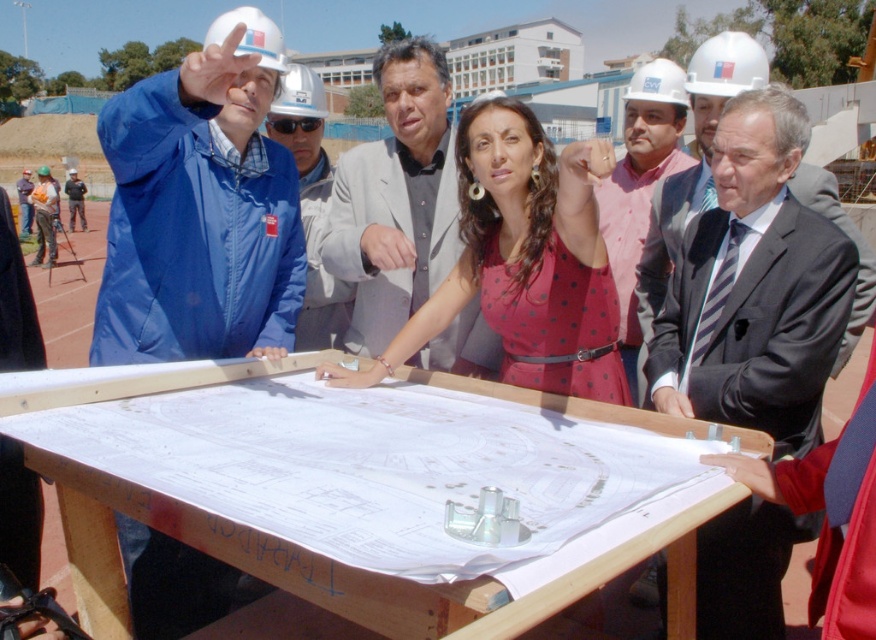
You are a photographer at the construction site and need to capture a clear photo of both the blue fabric jacket at left and the blue fabric jacket at upper left. Since the jackets are different in size, which one should you focus on to ensure both are visible in the frame?

The blue fabric jacket at left is bigger than the blue fabric jacket at upper left. To ensure both are visible, focus on the larger jacket first, then adjust the frame to include the smaller one without cropping either.

You are an architect standing at the edge of the construction site. You see the point marked at coordinates (524, 260) on the blueprint. What is the nearest object to this point?

The nearest object to the point marked at coordinates (524, 260) on the blueprint is the pink dotted dress at center.